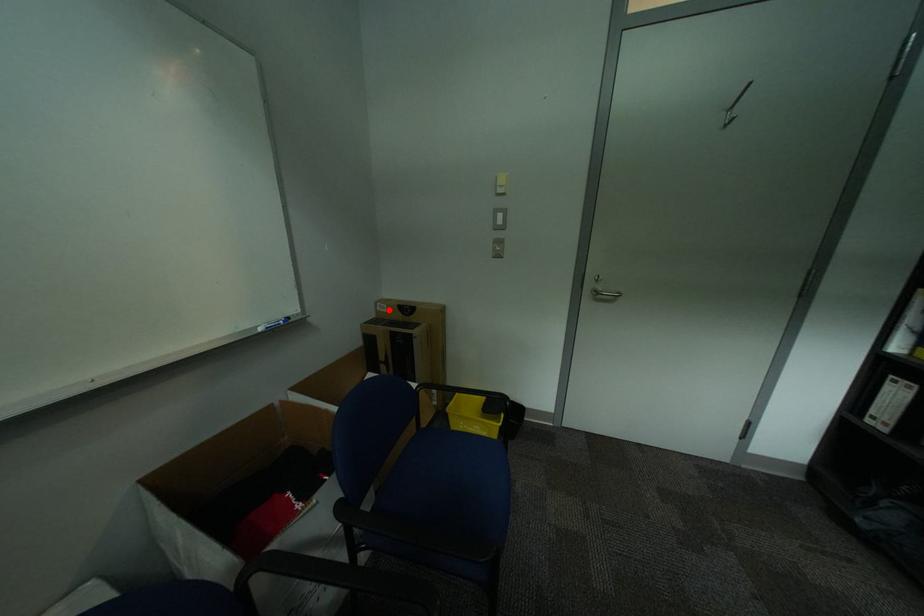
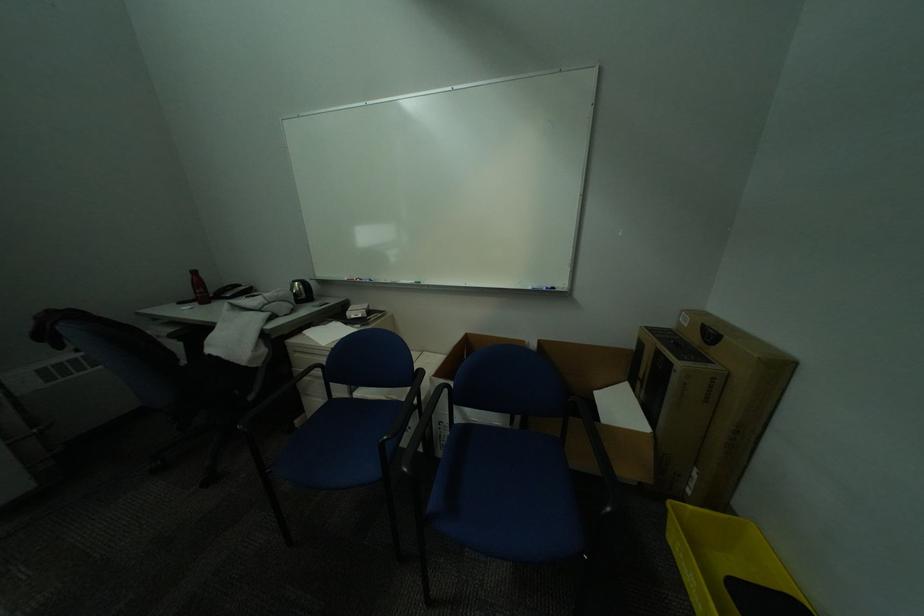
Question: I am providing you with two images of the same scene from different viewpoints. A red point is marked on the first image. Can you still see the location of the red point in image 2?

Choices:
 (A) Yes
 (B) No

Answer: (A)